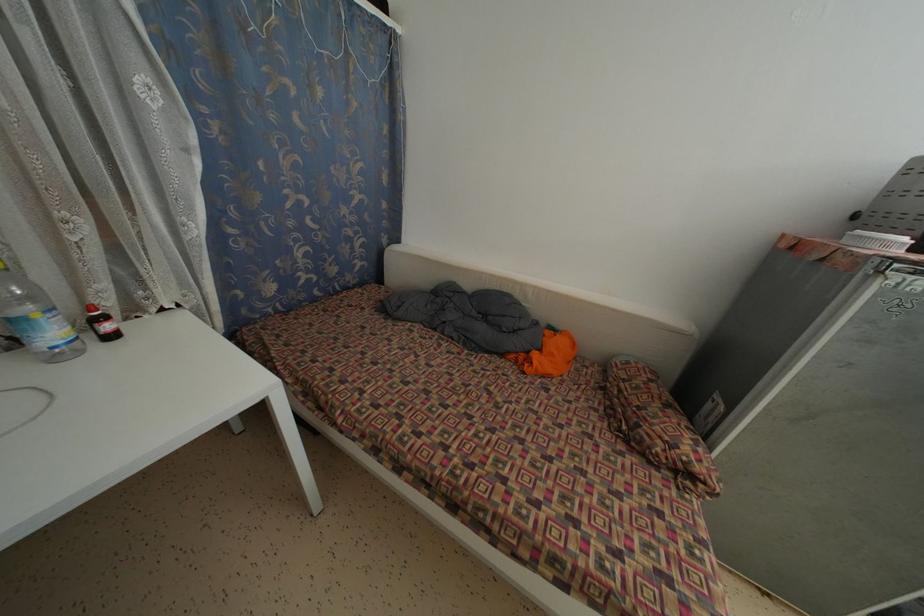
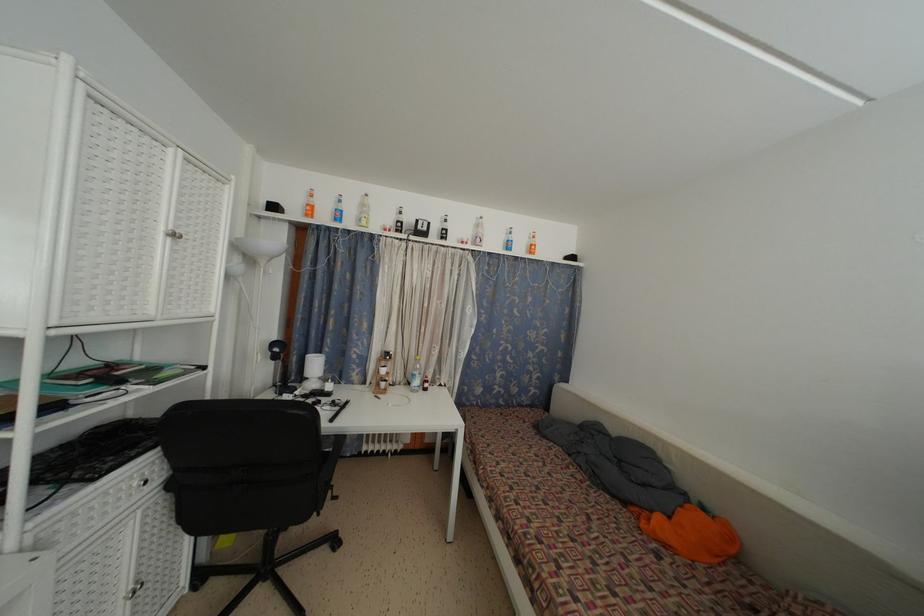
In the second image, find the point that corresponds to (57,339) in the first image.

(420, 387)